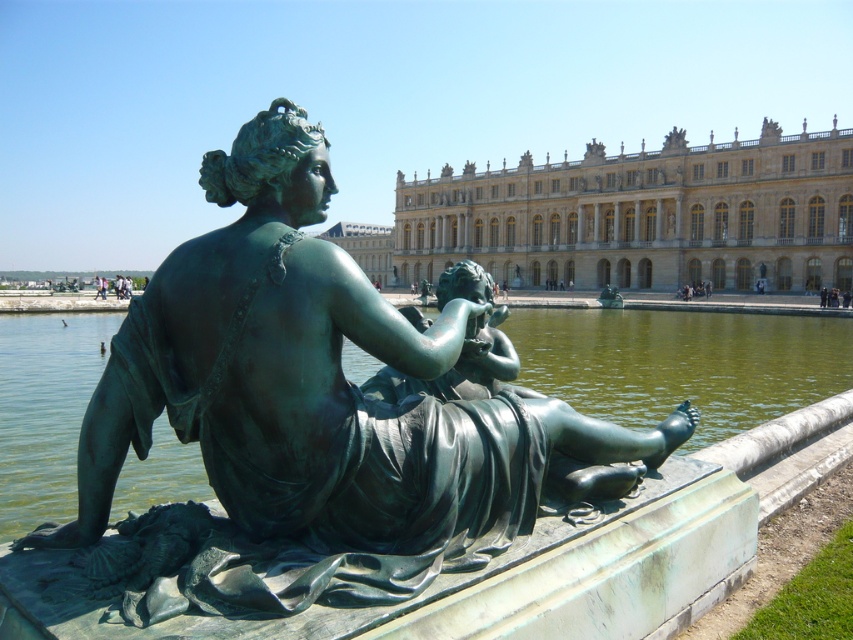
Which of these two, green patina statue at center or golden stone palace at center, stands taller?

golden stone palace at center

What do you see at coordinates (318, 413) in the screenshot?
I see `green patina statue at center` at bounding box center [318, 413].

Where is `green patina statue at center`? green patina statue at center is located at coordinates (318, 413).

Does point (451, 403) come behind point (817, 381)?

No, it is not.

Which is in front, point (207, 461) or point (78, 376)?

Point (207, 461) is more forward.

The width and height of the screenshot is (853, 640). In order to click on green patina statue at center in this screenshot , I will do `click(318, 413)`.

Between golden stone palace at center and green patina water at statue center, which one is positioned lower?

green patina water at statue center is below.

Between point (532, 288) and point (154, 465), which one is positioned behind?

Positioned behind is point (532, 288).

At what (x,y) coordinates should I click in order to perform the action: click on golden stone palace at center. Please return your answer as a coordinate pair (x, y). Looking at the image, I should click on (x=641, y=216).